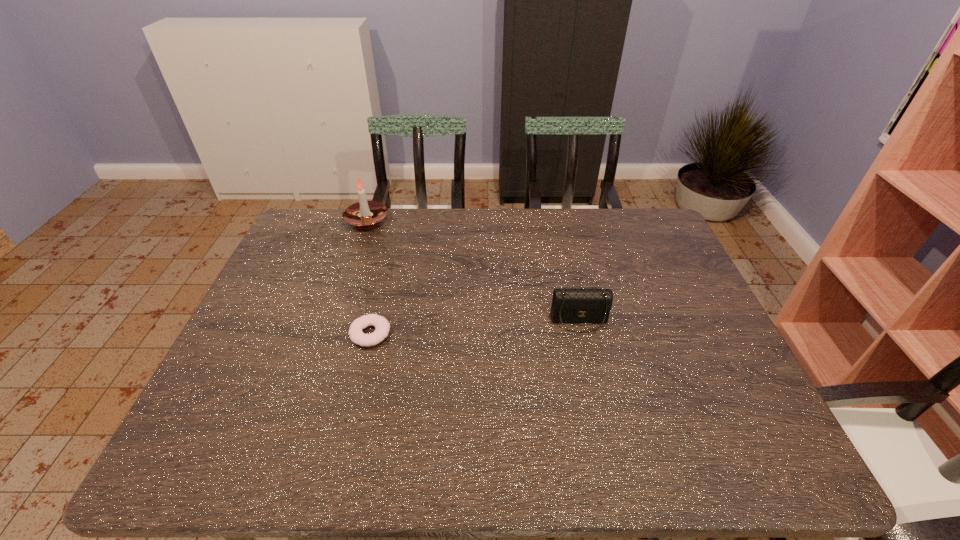
At what (x,y) coordinates should I click in order to perform the action: click on object that is positioned at the far left corner. Please return your answer as a coordinate pair (x, y). The width and height of the screenshot is (960, 540). Looking at the image, I should click on (364, 214).

Find the location of a particular element. The width and height of the screenshot is (960, 540). vacant space at the far edge of the desktop is located at coordinates (540, 228).

In the image, there is a desktop. In order to click on free space at the near edge in this screenshot , I will do `click(370, 440)`.

I want to click on vacant space at the left edge of the desktop, so click(287, 296).

Identify the location of vacant space at the right edge. (690, 292).

Identify the location of free location at the near left corner. click(x=241, y=471).

Locate an element on the screen. Image resolution: width=960 pixels, height=540 pixels. empty location between the rightmost object and the doughnut is located at coordinates (475, 327).

Find the location of a particular element. Image resolution: width=960 pixels, height=540 pixels. free space that is in between the rightmost object and the candle is located at coordinates (473, 270).

This screenshot has height=540, width=960. What are the coordinates of `free point between the tallest object and the shortest object` in the screenshot? It's located at (369, 276).

Where is `unoccupied position between the farthest object and the doughnut`? The width and height of the screenshot is (960, 540). unoccupied position between the farthest object and the doughnut is located at coordinates (369, 276).